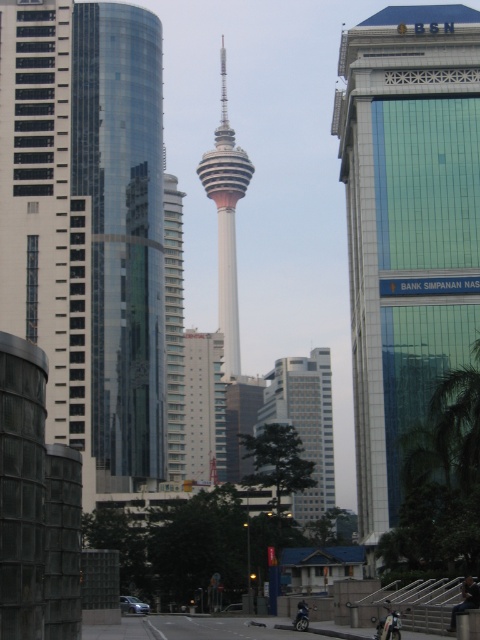
Question: Which point appears farthest from the camera in this image?

Choices:
 (A) (245, 157)
 (B) (396, 625)

Answer: (A)

Question: Which object appears closest to the camera in this image?

Choices:
 (A) white glass building at center
 (B) white smooth tower at center
 (C) transparent glass tower at center
 (D) shiny black motorcycle at lower center

Answer: (D)

Question: Is shiny chrome motorcycle at center wider than shiny black motorcycle at lower center?

Choices:
 (A) no
 (B) yes

Answer: (B)

Question: Can you confirm if green glass building at center is positioned to the right of shiny chrome motorcycle at center?

Choices:
 (A) yes
 (B) no

Answer: (A)

Question: Which point is farther to the camera?

Choices:
 (A) (445, 307)
 (B) (80, 17)

Answer: (B)

Question: Observing the image, what is the correct spatial positioning of white glass building at center in reference to white smooth tower at center?

Choices:
 (A) left
 (B) right

Answer: (B)